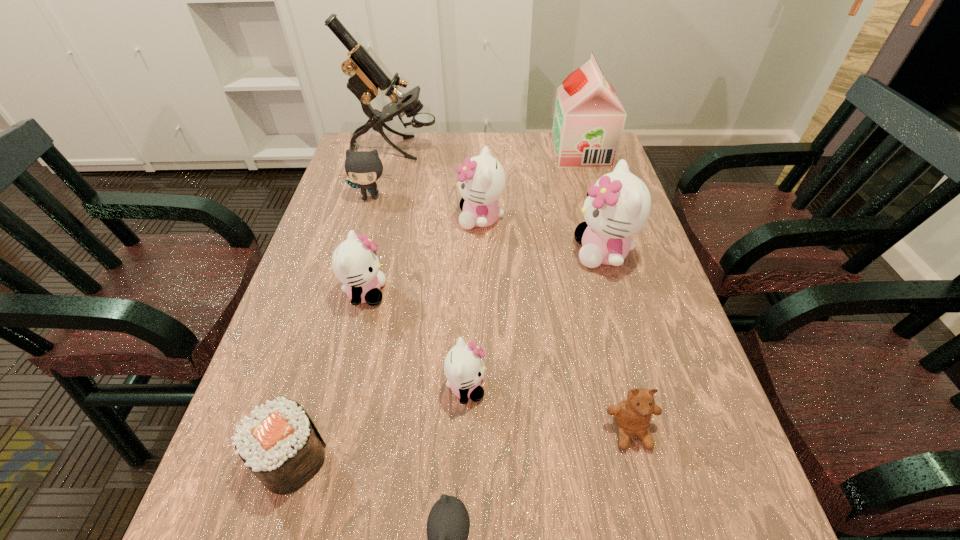
The width and height of the screenshot is (960, 540). I want to click on free location located 0.320m on the front-facing side of the second tallest kitten, so click(341, 219).

This screenshot has width=960, height=540. What are the coordinates of `vacant area situated 0.210m on the front-facing side of the second tallest kitten` in the screenshot? It's located at (381, 219).

Where is `blank space located 0.070m on the front-facing side of the second tallest kitten`? This screenshot has width=960, height=540. blank space located 0.070m on the front-facing side of the second tallest kitten is located at coordinates (432, 219).

This screenshot has height=540, width=960. Find the location of `vacant area situated on the front-facing side of the second smallest white kitten`. vacant area situated on the front-facing side of the second smallest white kitten is located at coordinates (413, 293).

The height and width of the screenshot is (540, 960). In order to click on free space located on the front-facing side of the bigger gray kitten in this screenshot , I will do `click(353, 256)`.

This screenshot has height=540, width=960. I want to click on free location located on the front-facing side of the smallest white kitten, so click(x=605, y=387).

This screenshot has height=540, width=960. What are the coordinates of `vacant space positioned 0.080m on the face of the teddy bear` in the screenshot? It's located at (649, 502).

Where is `vacant area located on the right of the sushi`? The height and width of the screenshot is (540, 960). vacant area located on the right of the sushi is located at coordinates coord(460,458).

The image size is (960, 540). I want to click on microscope located in the far edge section of the desktop, so click(366, 78).

This screenshot has height=540, width=960. In order to click on soya milk situated at the far edge in this screenshot , I will do `click(589, 118)`.